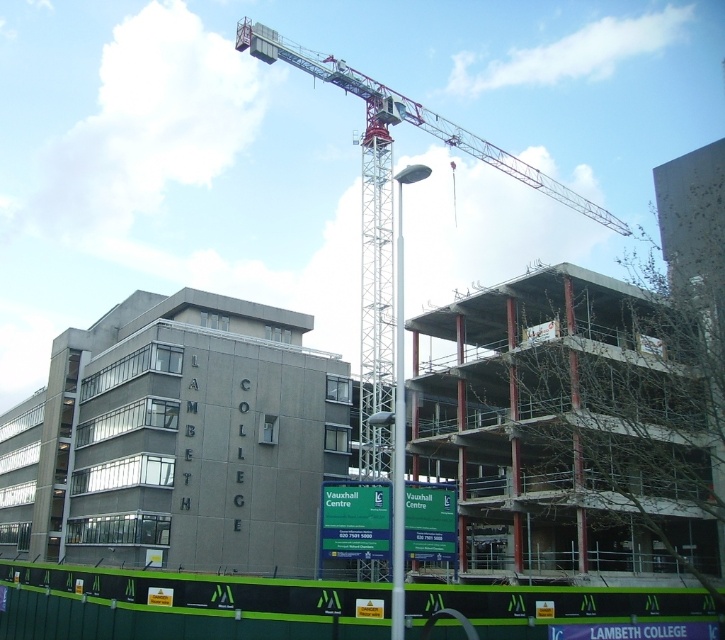
You are a construction worker who needs to lift heavy materials to the top floor of the partially constructed building. The metallic gray crane at upper center and the metallic pole at center are both in your line of sight. Which object would be more suitable for lifting materials to the upper floors?

The metallic gray crane at upper center is larger in size than the metallic pole at center, making it more suitable for lifting heavy materials to the upper floors of the partially constructed building.

You are a construction worker observing the site. There is a metallic gray crane at upper center and a metallic pole at center. Which object is positioned higher in the image?

The metallic gray crane at upper center is positioned higher than the metallic pole at center.